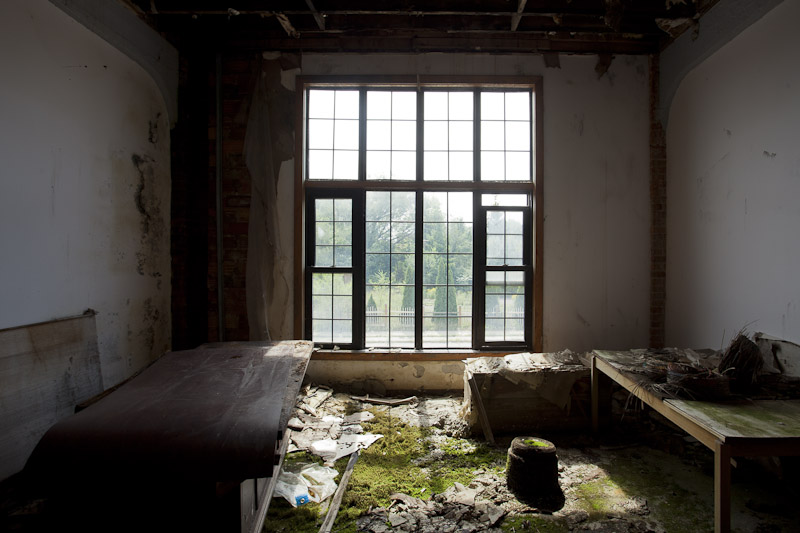
At what (x,y) coordinates should I click in order to perform the action: click on bench. Please return your answer as a coordinate pair (x, y). Image resolution: width=800 pixels, height=533 pixels. Looking at the image, I should click on tap(717, 441).